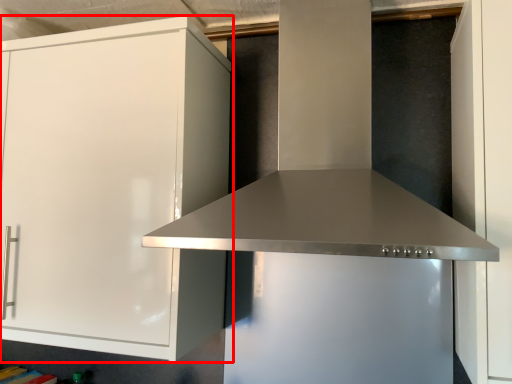
Question: From the image's perspective, where is cabinetry (annotated by the red box) located relative to vent?

Choices:
 (A) below
 (B) above

Answer: (A)